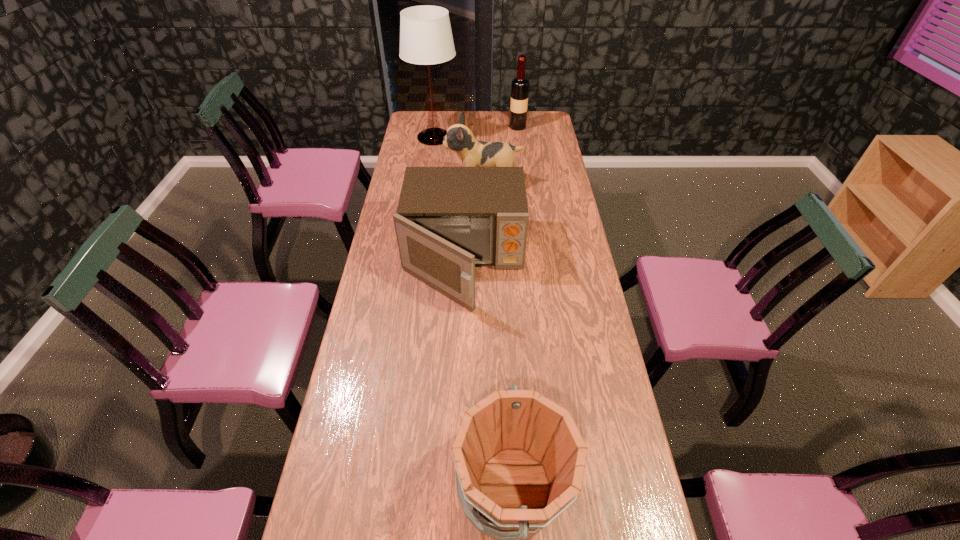
At what (x,y) coordinates should I click in order to perform the action: click on table lamp. Please return your answer as a coordinate pair (x, y). Image resolution: width=960 pixels, height=540 pixels. Looking at the image, I should click on (426, 38).

The width and height of the screenshot is (960, 540). In order to click on wine bottle in this screenshot , I will do `click(520, 86)`.

At what (x,y) coordinates should I click in order to perform the action: click on the third farthest object. Please return your answer as a coordinate pair (x, y). Looking at the image, I should click on (459, 138).

Identify the location of the third shortest object. (459, 138).

You are a GUI agent. You are given a task and a screenshot of the screen. Output one action in this format:
    pyautogui.click(x=<x>, y=<y>)
    Task: Click on the second nearest object
    Image resolution: width=960 pixels, height=540 pixels.
    Given the screenshot: What is the action you would take?
    pyautogui.click(x=449, y=219)

This screenshot has height=540, width=960. Find the location of `vacant space positioned above the cylindrical shade of the table lamp`. vacant space positioned above the cylindrical shade of the table lamp is located at coordinates (524, 137).

Find the location of `blank space located on the back of the second tallest object`. blank space located on the back of the second tallest object is located at coordinates (516, 116).

Locate an element on the screen. The image size is (960, 540). vacant space situated at the face of the third tallest object is located at coordinates (435, 183).

Locate an element on the screen. The image size is (960, 540). vacant position located 0.170m at the face of the third tallest object is located at coordinates (x=408, y=183).

The height and width of the screenshot is (540, 960). Find the location of `vacant position located at the face of the third tallest object`. vacant position located at the face of the third tallest object is located at coordinates (404, 183).